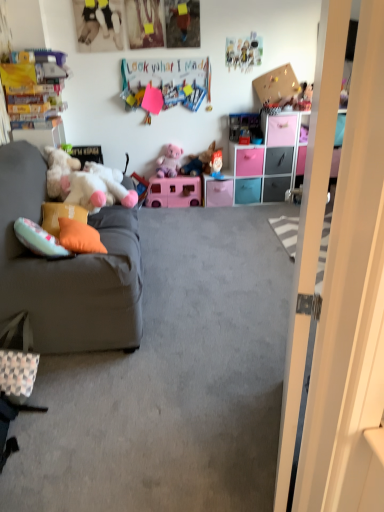
Locate an element on the screen. The height and width of the screenshot is (512, 384). free space that is in between velvet gray couch at left and checkered fabric bag at lower left is located at coordinates pyautogui.click(x=81, y=379).